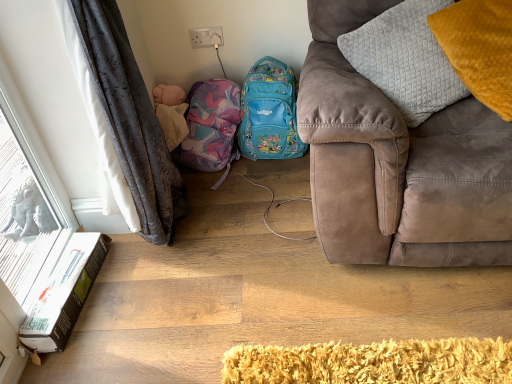
In order to click on vacant area on top of white cardboard box at lower left (from a real-world perspective) in this screenshot , I will do `click(62, 281)`.